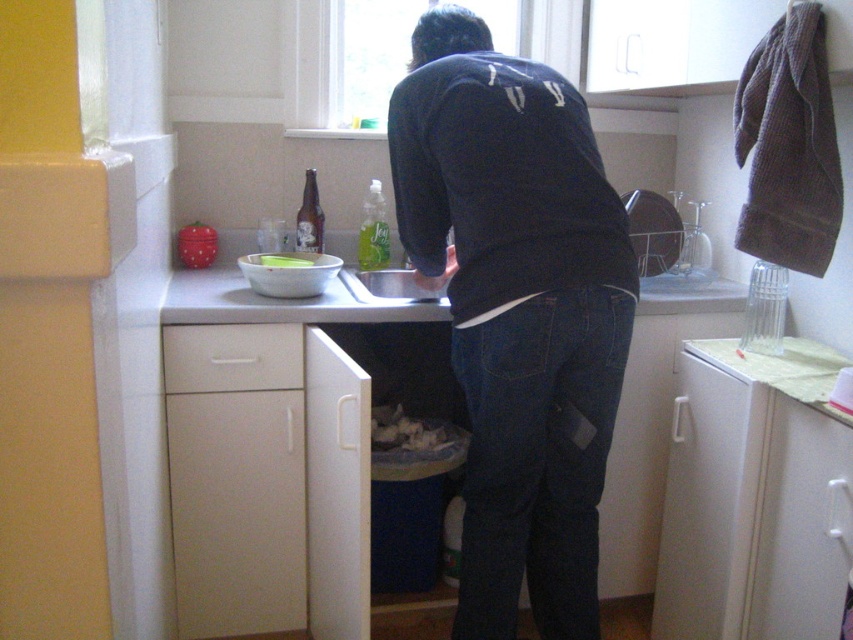
You are a drone flying at the same height as the two points in the kitchen scene. Which point is closer to you, point (846, 499) or point (363, 240)?

Point (846, 499) is closer to the camera than point (363, 240), so the drone would perceive it as closer.

You are organizing items in the kitchen and need to place the dark blue sweater at center and the brown glass bottle at center. According to their positions, which item is located more to the right?

The dark blue sweater at center is located more to the right than the brown glass bottle at center.